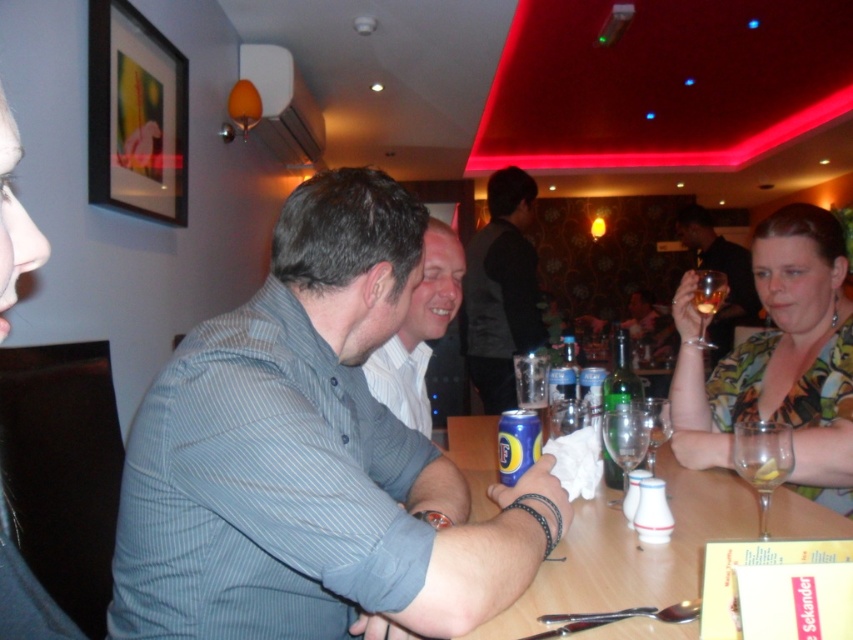
Question: Which point appears closest to the camera in this image?

Choices:
 (A) (809, 451)
 (B) (207, 548)
 (C) (416, 372)
 (D) (582, 556)

Answer: (B)

Question: Does striped cotton shirt at center appear on the left side of clear glass wine glass at table right?

Choices:
 (A) yes
 (B) no

Answer: (A)

Question: Which object is farther from the camera taking this photo?

Choices:
 (A) matte gray shirt at center
 (B) clear glass at table right

Answer: (A)

Question: Which is nearer to the dark gray vest at center?

Choices:
 (A) blue metallic can at center
 (B) striped cotton shirt at center

Answer: (A)

Question: In this image, where is striped cotton shirt at center located relative to clear glass wine glass at lower right?

Choices:
 (A) left
 (B) right

Answer: (A)

Question: Does printed fabric blouse at right appear on the left side of dark gray vest at center?

Choices:
 (A) yes
 (B) no

Answer: (B)